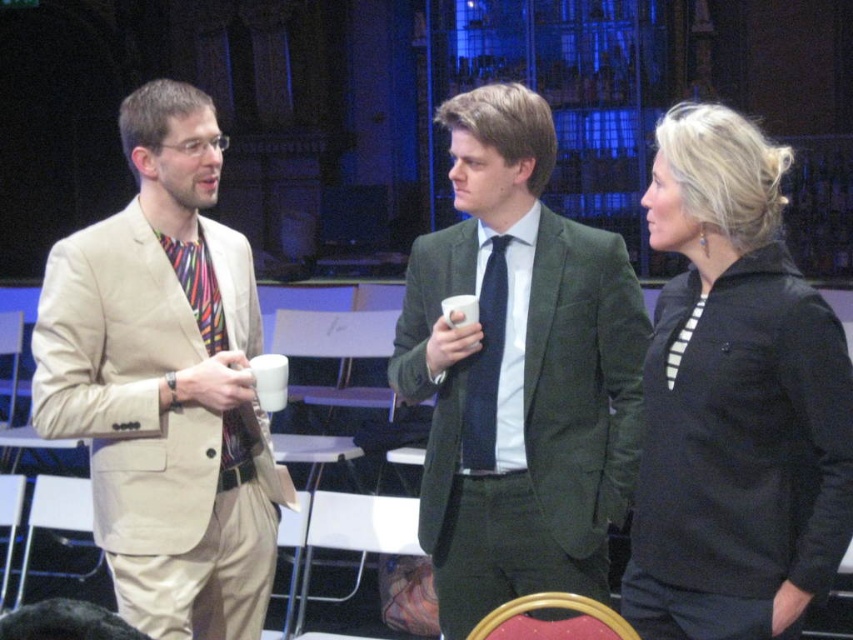
Does black matte jacket at center have a smaller size compared to white striped tie at center?

No, black matte jacket at center is not smaller than white striped tie at center.

The width and height of the screenshot is (853, 640). Identify the location of black matte jacket at center. (735, 401).

Who is taller, dark blue textured tie at center or multicolored fabric tie at left?

dark blue textured tie at center

Can you confirm if dark blue textured tie at center is wider than multicolored fabric tie at left?

No.

Describe the element at coordinates (485, 364) in the screenshot. I see `dark blue textured tie at center` at that location.

Locate an element on the screen. This screenshot has width=853, height=640. dark blue textured tie at center is located at coordinates (485, 364).

Is green velvet suit at center below white striped tie at center?

Indeed, green velvet suit at center is positioned under white striped tie at center.

This screenshot has height=640, width=853. Describe the element at coordinates (518, 371) in the screenshot. I see `green velvet suit at center` at that location.

Is point (498, 252) closer to camera compared to point (677, 333)?

That is False.

What are the coordinates of `green velvet suit at center` in the screenshot? It's located at (518, 371).